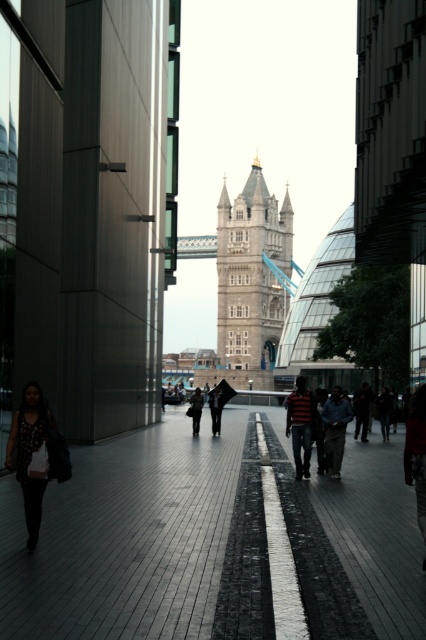
You are standing on the walkway and see both the polka dot dress at lower left and the metallic silver suspension bridge at center. Which object is closer to the left edge of the walkway?

The polka dot dress at lower left is closer to the left edge of the walkway because it is positioned to the left of the metallic silver suspension bridge at center.

You are standing at the entrance of the modern building and see both the polka dot dress at lower left and the metallic silver suspension bridge at center. Which object is closer to you?

The polka dot dress at lower left is closer to you because it is in front of the metallic silver suspension bridge at center.

You are a city planner evaluating the space between the shiny black pavement at center and the metallic silver suspension bridge at center. Which one occupies a larger area in the scene?

The metallic silver suspension bridge at center occupies a larger area in the scene since the shiny black pavement at center is smaller in size compared to it.